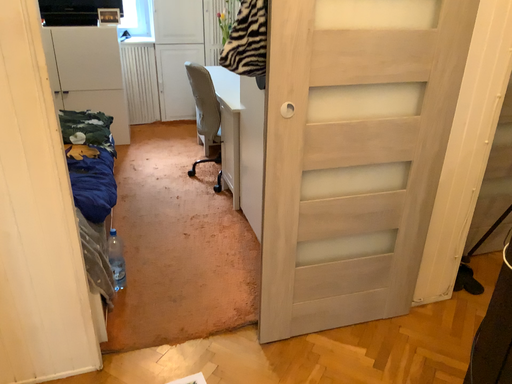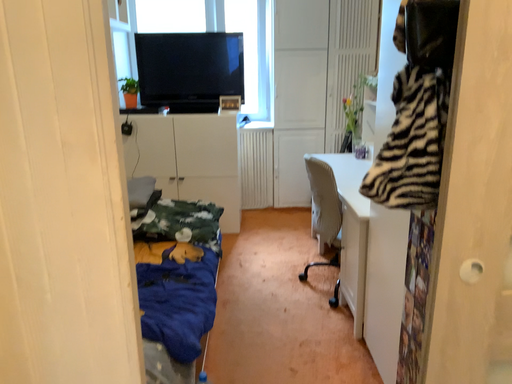
Question: Which way did the camera rotate in the video?

Choices:
 (A) rotated downward
 (B) rotated upward

Answer: (B)